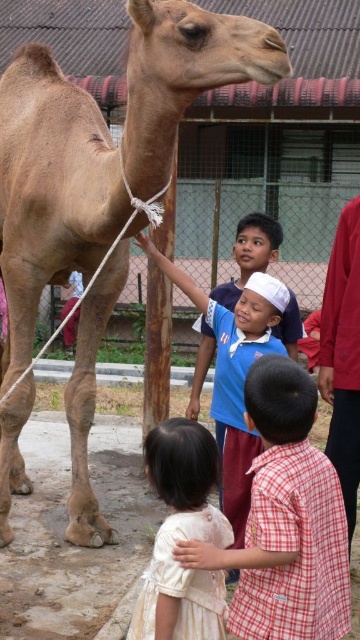
You are a photographer trying to capture a clear shot of the brown textured camel at left and the white cotton shirt at center. Based on their positions, which object should you focus on first to ensure it appears sharp in the foreground?

The white cotton shirt at center should be focused on first because it is closer to the foreground compared to the brown textured camel at left, which is positioned above it and likely farther away.

You are a photographer trying to capture a photo of the brown textured camel at left and the white cotton shirt at center. If you want to ensure both subjects are fully visible in the frame, which subject should you position closer to the camera to avoid cropping?

The brown textured camel at left is larger in width than the white cotton shirt at center, so you should position the white cotton shirt at center closer to the camera to ensure both are fully visible without cropping.

Consider the image. You are a photographer trying to capture a clear photo of the brown textured camel at left and the blue cotton shirt at center. Since the camel is in front of the blue cotton shirt, will you need to adjust your camera focus to include both subjects clearly in the same frame?

Since the brown textured camel at left is in front of the blue cotton shirt at center, adjusting the camera focus to a wider depth of field will ensure both subjects are in focus. However, if the distance between them is significant, you might need to focus on the camel first as it is closer to the camera.